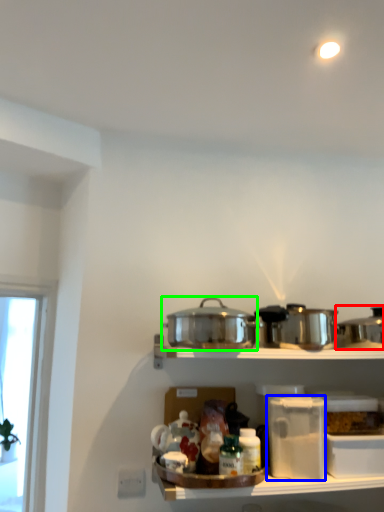
Question: Which is nearer to the crock pot (highlighted by a red box)? appliance (highlighted by a blue box) or crock pot (highlighted by a green box).

Choices:
 (A) appliance
 (B) crock pot

Answer: (A)